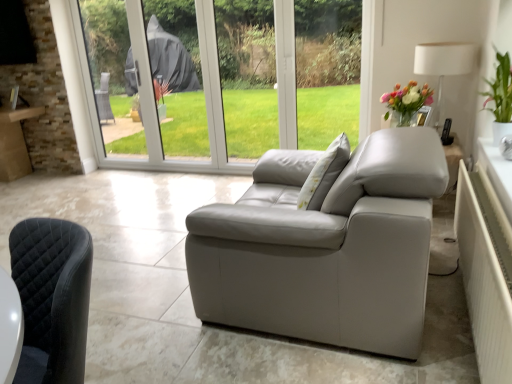
In order to face white fabric lampshade at upper right, should I rotate leftwards or rightwards?

You should rotate right by 23.536 degrees.

Where is `white fabric lampshade at upper right`? This screenshot has width=512, height=384. white fabric lampshade at upper right is located at coordinates (443, 64).

This screenshot has height=384, width=512. What do you see at coordinates (500, 90) in the screenshot?
I see `green leafy plant at upper right` at bounding box center [500, 90].

You are a GUI agent. You are given a task and a screenshot of the screen. Output one action in this format:
    pyautogui.click(x=<x>, y=<y>)
    Task: Click on the white textured radiator at right
    This screenshot has width=512, height=384.
    Given the screenshot: What is the action you would take?
    pyautogui.click(x=484, y=282)

Does green leafy plant at upper right have a larger size compared to white fabric lampshade at upper right?

No.

Does green leafy plant at upper right contain white fabric lampshade at upper right?

That's incorrect, white fabric lampshade at upper right is not inside green leafy plant at upper right.

Which object is closer to the camera taking this photo, green leafy plant at upper right or white fabric lampshade at upper right?

green leafy plant at upper right is closer to the camera.

Is green leafy plant at upper right looking in the opposite direction of white fabric lampshade at upper right?

No, green leafy plant at upper right is not facing away from white fabric lampshade at upper right.

From the image's perspective, is white textured radiator at right under white fabric lampshade at upper right?

Yes.

Which is behind, point (463, 261) or point (441, 51)?

The point (441, 51) is farther.

Looking at the image, does white textured radiator at right seem bigger or smaller compared to white fabric lampshade at upper right?

Clearly, white textured radiator at right is larger in size than white fabric lampshade at upper right.

Can you tell me how much white fabric lampshade at upper right and green leafy plant at upper right differ in facing direction?

0.000547 degrees separate the facing orientations of white fabric lampshade at upper right and green leafy plant at upper right.

Considering the sizes of objects white fabric lampshade at upper right and green leafy plant at upper right in the image provided, who is bigger, white fabric lampshade at upper right or green leafy plant at upper right?

With larger size is white fabric lampshade at upper right.

Between point (441, 94) and point (506, 114), which one is positioned in front?

The point (506, 114) is in front.

Choose the correct answer: Is white fabric lampshade at upper right inside green leafy plant at upper right or outside it?

white fabric lampshade at upper right is outside green leafy plant at upper right.

Do you think white textured radiator at right is within green leafy plant at upper right, or outside of it?

white textured radiator at right is spatially situated outside green leafy plant at upper right.

In terms of width, does white textured radiator at right look wider or thinner when compared to green leafy plant at upper right?

Clearly, white textured radiator at right has less width compared to green leafy plant at upper right.

Is white textured radiator at right further to camera compared to green leafy plant at upper right?

No.

From the image's perspective, would you say green leafy plant at upper right is positioned over white textured radiator at right?

Yes, from the image's perspective, green leafy plant at upper right is over white textured radiator at right.

Is green leafy plant at upper right positioned beyond the bounds of white textured radiator at right?

Yes, green leafy plant at upper right is located beyond the bounds of white textured radiator at right.

Can you confirm if white fabric lampshade at upper right is wider than white textured radiator at right?

Correct, the width of white fabric lampshade at upper right exceeds that of white textured radiator at right.

From the image's perspective, which one is positioned higher, white fabric lampshade at upper right or white textured radiator at right?

white fabric lampshade at upper right, from the image's perspective.

Between white fabric lampshade at upper right and white textured radiator at right, which one appears on the right side from the viewer's perspective?

white fabric lampshade at upper right is more to the right.

Could you tell me if white fabric lampshade at upper right is turned towards white textured radiator at right?

No, white fabric lampshade at upper right is not turned towards white textured radiator at right.

This screenshot has height=384, width=512. I want to click on plant below the white fabric lampshade at upper right (from the image's perspective), so coord(500,90).

You are a GUI agent. You are given a task and a screenshot of the screen. Output one action in this format:
    pyautogui.click(x=<x>, y=<y>)
    Task: Click on the radiator below the white fabric lampshade at upper right (from a real-world perspective)
    Image resolution: width=512 pixels, height=384 pixels.
    Given the screenshot: What is the action you would take?
    pyautogui.click(x=484, y=282)

Estimate the real-world distances between objects in this image. Which object is further from green leafy plant at upper right, white textured radiator at right or white fabric lampshade at upper right?

white textured radiator at right is positioned further to the anchor green leafy plant at upper right.

When comparing their distances from white textured radiator at right, does white fabric lampshade at upper right or green leafy plant at upper right seem closer?

Among the two, green leafy plant at upper right is located nearer to white textured radiator at right.

When comparing their distances from green leafy plant at upper right, does white fabric lampshade at upper right or white textured radiator at right seem further?

white textured radiator at right lies further to green leafy plant at upper right than the other object.

Based on their spatial positions, is white textured radiator at right or green leafy plant at upper right further from white fabric lampshade at upper right?

white textured radiator at right is further to white fabric lampshade at upper right.

Estimate the real-world distances between objects in this image. Which object is closer to white fabric lampshade at upper right, green leafy plant at upper right or white textured radiator at right?

green leafy plant at upper right is closer to white fabric lampshade at upper right.

Looking at this image, when comparing their distances from white textured radiator at right, does green leafy plant at upper right or white fabric lampshade at upper right seem closer?

green leafy plant at upper right lies closer to white textured radiator at right than the other object.

Image resolution: width=512 pixels, height=384 pixels. I want to click on plant positioned between white textured radiator at right and white fabric lampshade at upper right from near to far, so click(x=500, y=90).